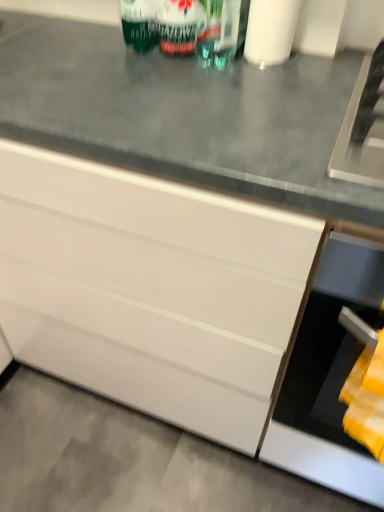
Identify the location of vacant area situated to the left side of green glass wine bottle at upper center. click(x=130, y=72).